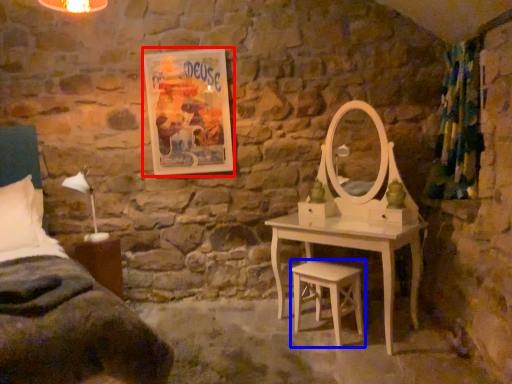
Question: Among these objects, which one is nearest to the camera, picture frame (highlighted by a red box) or stool (highlighted by a blue box)?

Choices:
 (A) picture frame
 (B) stool

Answer: (B)